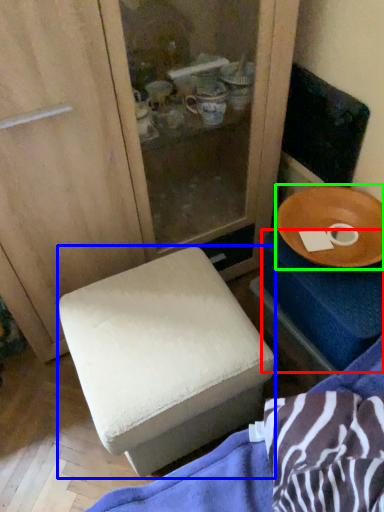
Question: Considering the real-world distances, which object is farthest from changing table (highlighted by a red box)? furniture (highlighted by a blue box) or tableware (highlighted by a green box)?

Choices:
 (A) furniture
 (B) tableware

Answer: (A)